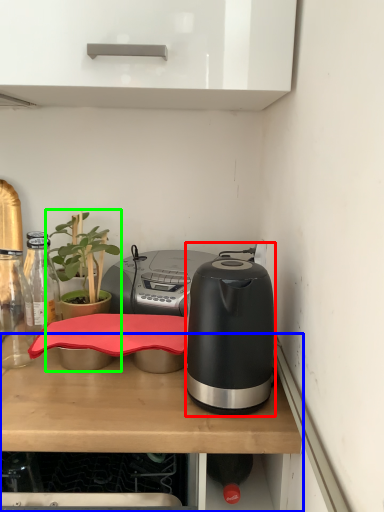
Question: Which object is positioned closest to kitchen appliance (highlighted by a red box)? Select from desk (highlighted by a blue box) and houseplant (highlighted by a green box).

Choices:
 (A) desk
 (B) houseplant

Answer: (A)